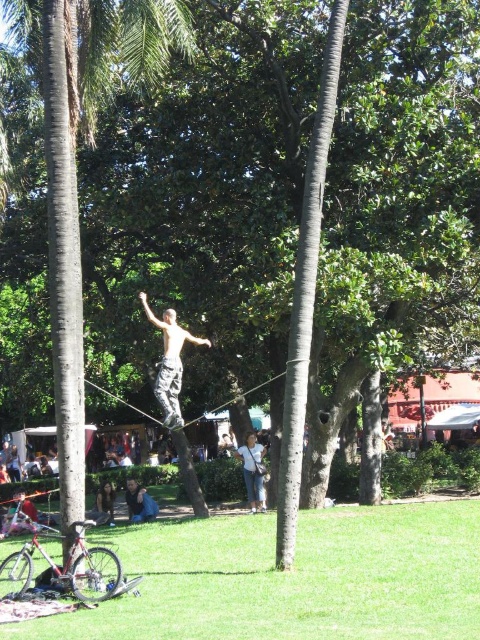
From the picture: You are standing in the park and see the green textured palm tree at center and the blue denim jeans at lower left. Which object is positioned more to the east if the sun is setting in the west?

The green textured palm tree at center is to the right of the blue denim jeans at lower left. Since the sun is setting in the west, the right side of the image would correspond to the east. Therefore, the green textured palm tree at center is positioned more to the east.

You are a photographer trying to capture a closeup of the light brown hair at lower left without including the blue denim jeans at lower left in the frame. Is this possible given their current positions?

The blue denim jeans at lower left is positioned over light brown hair at lower left, so the jeans are covering the hair. Therefore, it is not possible to capture the hair without the jeans in the frame.

You are a photographer trying to capture the slackliner in the park scene. You notice two points in the image labeled as point 1 and point 2. If point 1 is at coordinate (152,499) and point 2 is at (108,481), which point is closer to your camera lens when taking the photo?

Point 1 at coordinate (152,499) is closer to the camera lens than point 2 at (108,481).